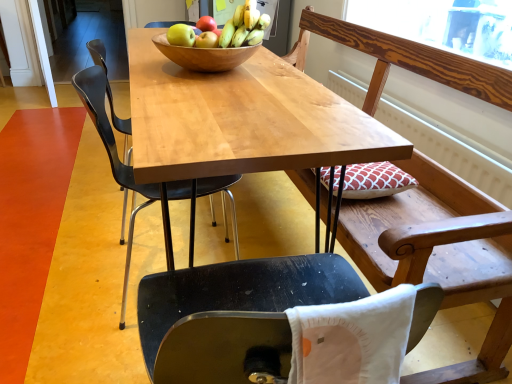
Question: From a real-world perspective, is white fabric pillow at lower center positioned above or below wooden bench at upper right?

Choices:
 (A) below
 (B) above

Answer: (B)

Question: Does point (412, 311) appear closer or farther from the camera than point (361, 231)?

Choices:
 (A) farther
 (B) closer

Answer: (B)

Question: Which object is positioned farthest from the yellow matte bananas at center?

Choices:
 (A) matte green apple at center, which appears as the 2th apple when viewed from the front
 (B) matte yellow apple at center, the 1th apple viewed from the front
 (C) matte red apple at center, which is the 1th apple from back to front
 (D) white fabric pillow at lower center
 (E) wooden bench at upper right

Answer: (D)

Question: Estimate the real-world distances between objects in this image. Which object is closer to the matte yellow apple at center, the 1th apple viewed from the front?

Choices:
 (A) matte red apple at center, which is the 1th apple from back to front
 (B) wooden table at center
 (C) matte green apple at center, which appears as the 2th apple when viewed from the front
 (D) wooden bench at upper right
 (E) wooden bowl at center

Answer: (C)